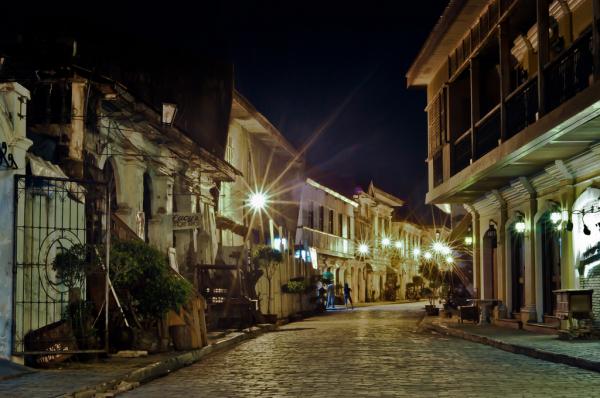
Image resolution: width=600 pixels, height=398 pixels. Identify the location of entrance. (387, 287).